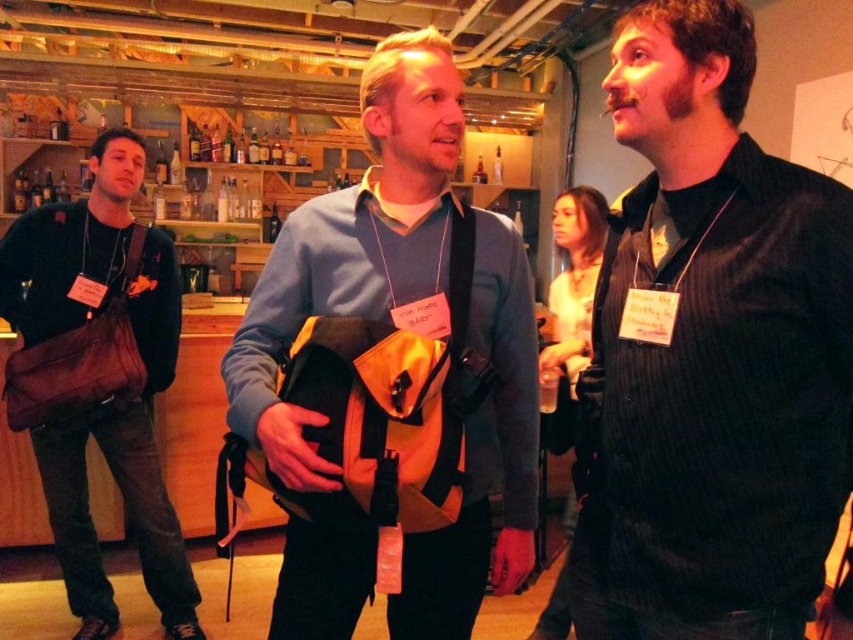
Question: Can you confirm if black pinstripe shirt at center is thinner than brown canvas bag at left?

Choices:
 (A) no
 (B) yes

Answer: (B)

Question: Considering the relative positions of yellow fabric backpack at center and brown canvas bag at left in the image provided, where is yellow fabric backpack at center located with respect to brown canvas bag at left?

Choices:
 (A) above
 (B) below

Answer: (A)

Question: Among these objects, which one is farthest from the camera?

Choices:
 (A) yellow fabric backpack at center
 (B) brown canvas bag at left
 (C) black pinstripe shirt at center

Answer: (B)

Question: Which point appears closest to the camera in this image?

Choices:
 (A) (485, 314)
 (B) (67, 467)
 (C) (686, 136)

Answer: (C)

Question: Based on their relative distances, which object is nearer to the brown canvas bag at left?

Choices:
 (A) yellow fabric backpack at center
 (B) black pinstripe shirt at center

Answer: (A)

Question: In this image, where is black pinstripe shirt at center located relative to yellow fabric backpack at center?

Choices:
 (A) above
 (B) below

Answer: (A)